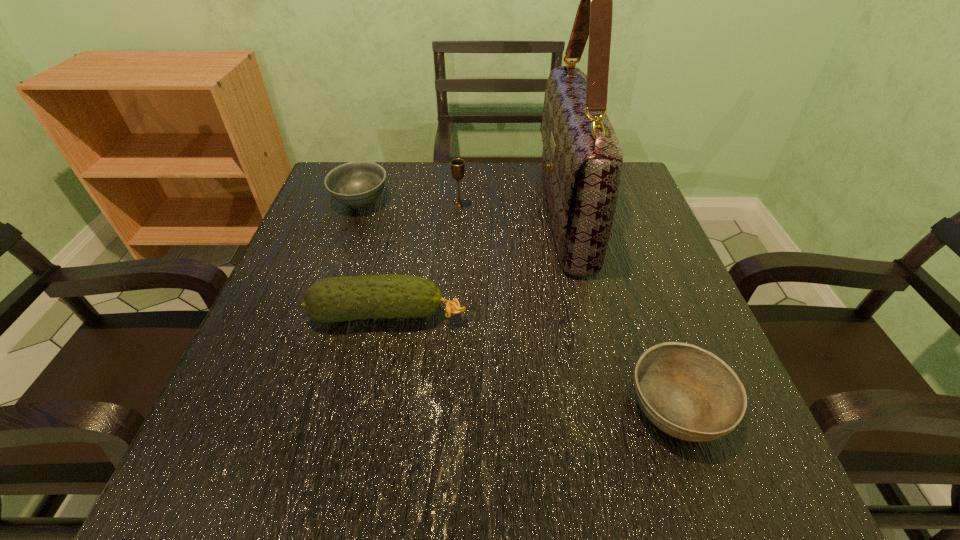
The width and height of the screenshot is (960, 540). What are the coordinates of `vacant space situated 0.100m on the front of the chalice` in the screenshot? It's located at (458, 236).

This screenshot has width=960, height=540. In order to click on free space located at the blossom end of the fourth farthest object in this screenshot , I will do `click(520, 315)`.

Where is `vacant space located 0.270m on the front of the farther bowl`? The image size is (960, 540). vacant space located 0.270m on the front of the farther bowl is located at coordinates (325, 303).

You are a GUI agent. You are given a task and a screenshot of the screen. Output one action in this format:
    pyautogui.click(x=<x>, y=<y>)
    Task: Click on the vacant region located on the left of the right bowl
    
    Given the screenshot: What is the action you would take?
    click(383, 406)

Find the location of a particular element. handbag positioned at the far edge is located at coordinates (582, 159).

Where is `chalice positioned at the far edge`? Image resolution: width=960 pixels, height=540 pixels. chalice positioned at the far edge is located at coordinates (457, 165).

At what (x,y) coordinates should I click in order to perform the action: click on bowl present at the far edge. Please return your answer as a coordinate pair (x, y). Looking at the image, I should click on (359, 183).

The height and width of the screenshot is (540, 960). Find the location of `object positioned at the near edge`. object positioned at the near edge is located at coordinates (689, 393).

This screenshot has width=960, height=540. Identify the location of cucumber that is at the left edge. (346, 298).

Find the location of `bowl at the left edge`. bowl at the left edge is located at coordinates [359, 183].